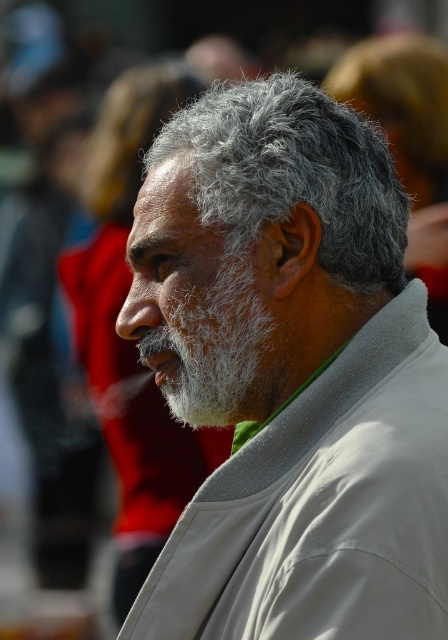
Question: Considering the relative positions of gray fluffy hair at center and gray fuzzy hair at center in the image provided, where is gray fluffy hair at center located with respect to gray fuzzy hair at center?

Choices:
 (A) right
 (B) left

Answer: (A)

Question: Which object appears closest to the camera in this image?

Choices:
 (A) gray fluffy hair at center
 (B) gray hair at center
 (C) white fuzzy beard at center

Answer: (B)

Question: Is gray hair at center wider than gray fuzzy hair at center?

Choices:
 (A) no
 (B) yes

Answer: (B)

Question: Which object is positioned farthest from the gray fuzzy hair at center?

Choices:
 (A) gray fluffy hair at center
 (B) gray hair at center

Answer: (B)

Question: Based on their relative distances, which object is nearer to the gray hair at center?

Choices:
 (A) gray fluffy hair at center
 (B) gray fuzzy hair at center
 (C) white fuzzy beard at center

Answer: (C)

Question: Where is gray hair at center located in relation to gray fuzzy hair at center in the image?

Choices:
 (A) left
 (B) right

Answer: (B)